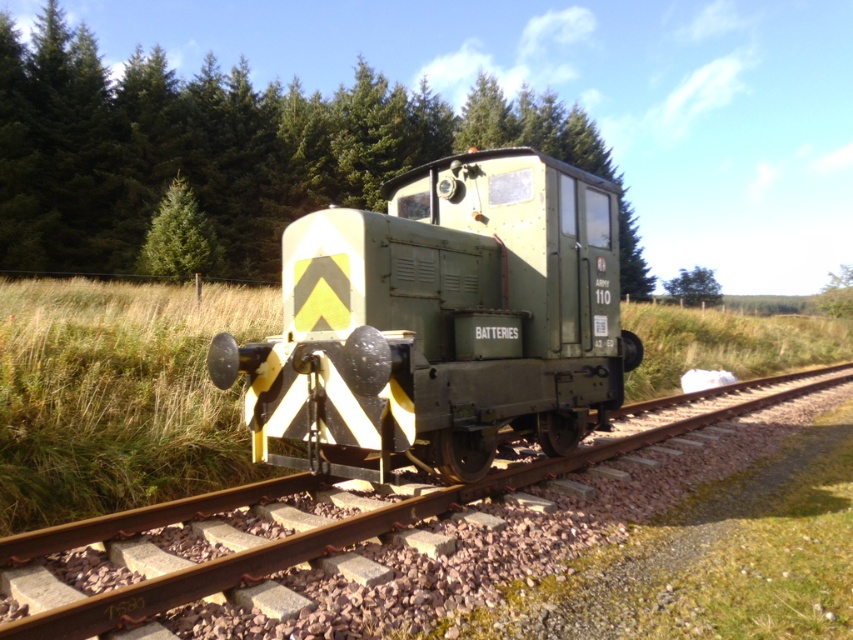
Question: Can you confirm if yellow/black striped track at center is positioned to the right of green textured tree at center?

Choices:
 (A) yes
 (B) no

Answer: (A)

Question: Among these objects, which one is nearest to the camera?

Choices:
 (A) green leafy tree at upper right
 (B) yellow/black striped track at center

Answer: (B)

Question: Which object is positioned farthest from the green textured pine tree at upper left?

Choices:
 (A) green grass at center
 (B) yellow/black striped track at center
 (C) green textured tree at center
 (D) matte green train at center

Answer: (D)

Question: Which point is closer to the camera?

Choices:
 (A) matte green train at center
 (B) green textured pine tree at upper left
 (C) green grass at center

Answer: (A)

Question: Is matte green train at center to the left of green leafy tree at upper right from the viewer's perspective?

Choices:
 (A) no
 (B) yes

Answer: (B)

Question: Does yellow/black striped track at center appear on the right side of green textured tree at center?

Choices:
 (A) no
 (B) yes

Answer: (B)